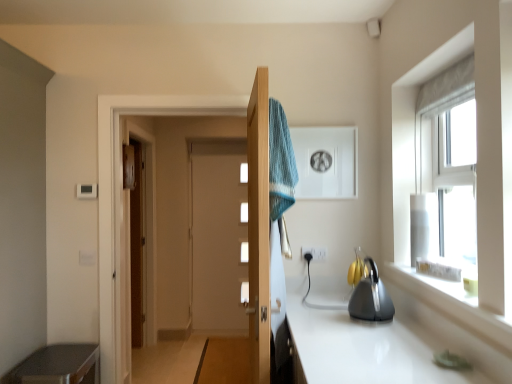
Question: Can you confirm if wooden door at center is positioned to the left of blue knitted towel at center?

Choices:
 (A) no
 (B) yes

Answer: (B)

Question: Can you confirm if wooden door at center is smaller than blue knitted towel at center?

Choices:
 (A) no
 (B) yes

Answer: (A)

Question: From a real-world perspective, is wooden door at center on blue knitted towel at center?

Choices:
 (A) yes
 (B) no

Answer: (B)

Question: From a real-world perspective, does wooden door at center sit lower than blue knitted towel at center?

Choices:
 (A) yes
 (B) no

Answer: (A)

Question: Would you say blue knitted towel at center is part of wooden door at center's contents?

Choices:
 (A) no
 (B) yes

Answer: (A)

Question: Choose the correct answer: Is blue knitted towel at center inside metallic gray cabinet at lower left or outside it?

Choices:
 (A) inside
 (B) outside

Answer: (B)

Question: Based on their sizes in the image, would you say blue knitted towel at center is bigger or smaller than metallic gray cabinet at lower left?

Choices:
 (A) big
 (B) small

Answer: (B)

Question: Considering their positions, is blue knitted towel at center located in front of or behind metallic gray cabinet at lower left?

Choices:
 (A) front
 (B) behind

Answer: (A)

Question: Considering the relative positions of blue knitted towel at center and metallic gray cabinet at lower left in the image provided, is blue knitted towel at center to the left or to the right of metallic gray cabinet at lower left?

Choices:
 (A) right
 (B) left

Answer: (A)

Question: Considering the relative positions of metallic gray cabinet at lower left and clear glass window at upper right in the image provided, is metallic gray cabinet at lower left to the left or to the right of clear glass window at upper right?

Choices:
 (A) right
 (B) left

Answer: (B)

Question: In terms of height, does metallic gray cabinet at lower left look taller or shorter compared to clear glass window at upper right?

Choices:
 (A) short
 (B) tall

Answer: (A)

Question: From the image's perspective, is metallic gray cabinet at lower left positioned above or below clear glass window at upper right?

Choices:
 (A) below
 (B) above

Answer: (A)

Question: In terms of width, does metallic gray cabinet at lower left look wider or thinner when compared to clear glass window at upper right?

Choices:
 (A) thin
 (B) wide

Answer: (B)

Question: In terms of width, does metallic gray cabinet at lower left look wider or thinner when compared to white plastic electric outlet at center?

Choices:
 (A) wide
 (B) thin

Answer: (A)

Question: In terms of size, does metallic gray cabinet at lower left appear bigger or smaller than white plastic electric outlet at center?

Choices:
 (A) small
 (B) big

Answer: (B)